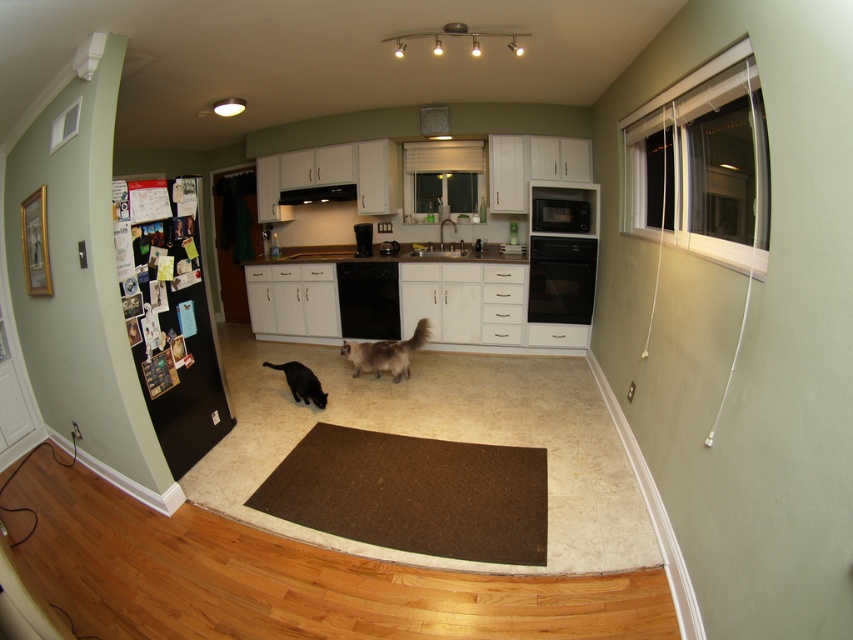
What do you see at coordinates (368, 300) in the screenshot? I see `black glossy dishwasher at center` at bounding box center [368, 300].

Is black glossy dishwasher at center to the right of fuzzy white cat at center from the viewer's perspective?

Incorrect, black glossy dishwasher at center is not on the right side of fuzzy white cat at center.

Is point (352, 272) positioned in front of point (392, 374)?

That is False.

The width and height of the screenshot is (853, 640). Find the location of `black glossy dishwasher at center`. black glossy dishwasher at center is located at coordinates (368, 300).

The width and height of the screenshot is (853, 640). What do you see at coordinates (560, 216) in the screenshot?
I see `black matte microwave at center` at bounding box center [560, 216].

Does black matte microwave at center have a larger size compared to black matte exhaust hood at center?

Incorrect, black matte microwave at center is not larger than black matte exhaust hood at center.

Between point (544, 225) and point (292, 195), which one is positioned behind?

The point (292, 195) is behind.

You are a GUI agent. You are given a task and a screenshot of the screen. Output one action in this format:
    pyautogui.click(x=<x>, y=<y>)
    Task: Click on the black matte microwave at center
    This screenshot has height=640, width=853.
    Given the screenshot: What is the action you would take?
    pyautogui.click(x=560, y=216)

Is black matte oven at center thinner than black glossy dishwasher at center?

No, black matte oven at center is not thinner than black glossy dishwasher at center.

Can you confirm if black matte oven at center is smaller than black glossy dishwasher at center?

No.

What do you see at coordinates (561, 252) in the screenshot? The image size is (853, 640). I see `black matte oven at center` at bounding box center [561, 252].

The image size is (853, 640). Identify the location of black matte oven at center. (561, 252).